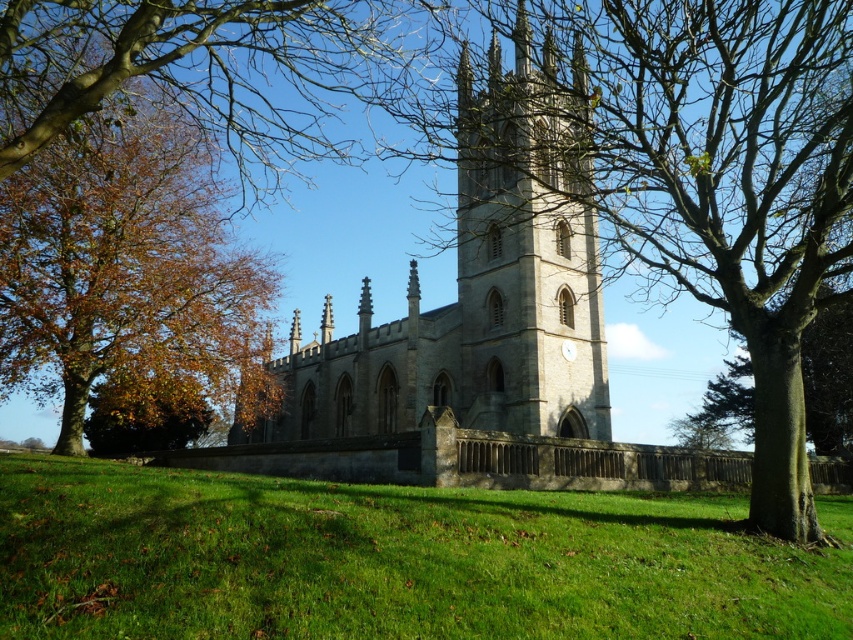
Can you confirm if autumn leaves at left is positioned above stone clock tower at center?

Incorrect, autumn leaves at left is not positioned above stone clock tower at center.

Is autumn leaves at left taller than stone clock tower at center?

No.

Identify the location of autumn leaves at left. The height and width of the screenshot is (640, 853). (120, 259).

Who is more forward, (815, 19) or (171, 170)?

Point (815, 19) is more forward.

Is bare wood tree at center positioned in front of autumn leaves at left?

Yes, bare wood tree at center is in front of autumn leaves at left.

I want to click on bare wood tree at center, so click(730, 182).

Does point (728, 285) come behind point (606, 438)?

No, it is in front of (606, 438).

Identify the location of bare wood tree at center. (730, 182).